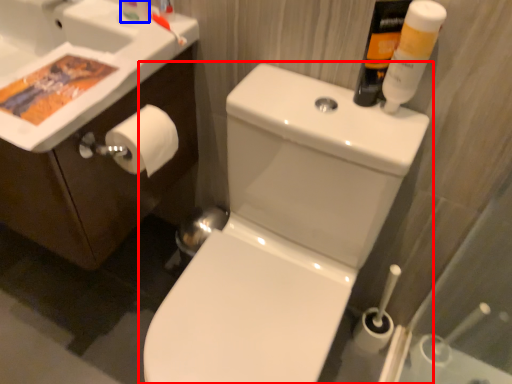
Question: Which of the following is the closest to the observer, toilet (highlighted by a red box) or toiletry (highlighted by a blue box)?

Choices:
 (A) toilet
 (B) toiletry

Answer: (A)